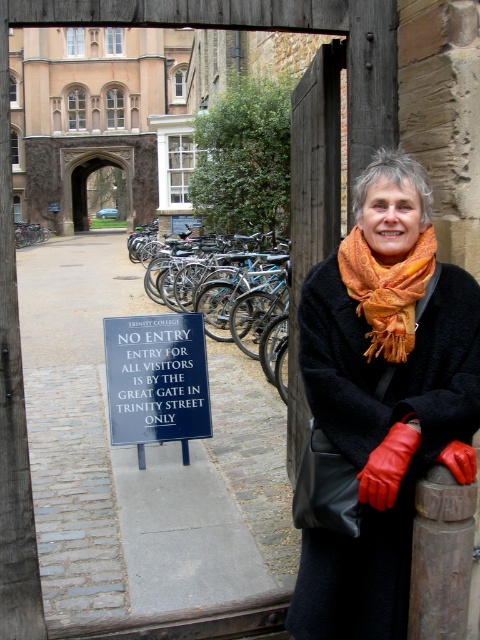
You are standing at the entrance of Trinity College, Cambridge, looking at the scene described. There is an orange scarf at upper center. Where exactly is the orange scarf located in terms of coordinates?

The orange scarf at upper center is located at coordinates point (383, 396).

You are a visitor at Trinity College, Cambridge, and you notice the blue metallic bicycle at center and the orange woven scarf at upper center. Which object appears larger in the image?

The orange woven scarf at upper center appears larger than the blue metallic bicycle at center in the image.

You are a visitor at Trinity College, Cambridge, and you see an orange scarf at upper center and a blue plastic sign at center. Which object is narrower in width?

The orange scarf at upper center has a lesser width compared to the blue plastic sign at center, so the orange scarf at upper center is narrower.